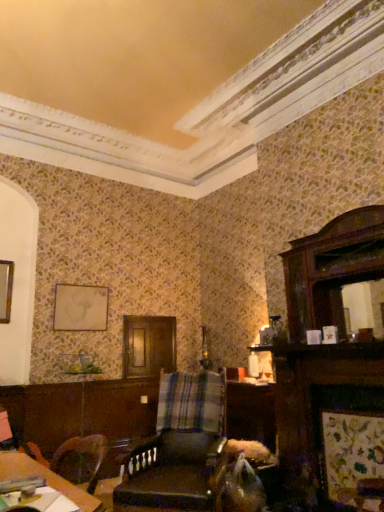
Question: From the image's perspective, relative to leather at center, is wooden table at lower left above or below?

Choices:
 (A) above
 (B) below

Answer: (A)

Question: In terms of size, does wooden table at lower left appear bigger or smaller than leather at center?

Choices:
 (A) big
 (B) small

Answer: (B)

Question: Which object is positioned farthest from the wooden table at lower left?

Choices:
 (A) leather at center
 (B) matte gold picture frame at upper left

Answer: (B)

Question: Which object is positioned closest to the leather at center?

Choices:
 (A) wooden table at lower left
 (B) matte gold picture frame at upper left

Answer: (A)